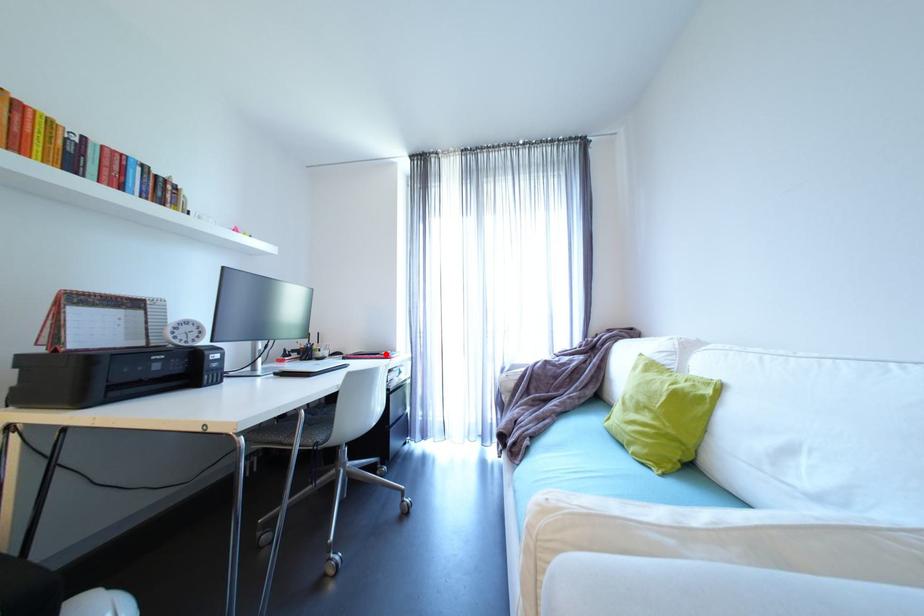
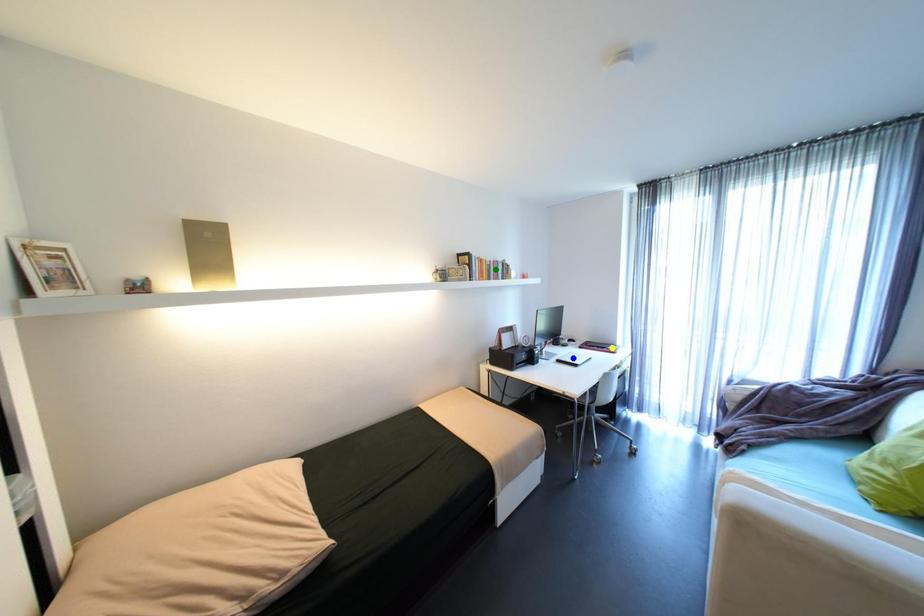
Question: I am providing you with two images of the same scene from different viewpoints. A red point is marked on the first image. You are given multiple points on the second image. Which point in image 2 represents the same 3d spot as the red point in image 1?

Choices:
 (A) blue point
 (B) green point
 (C) yellow point

Answer: (C)